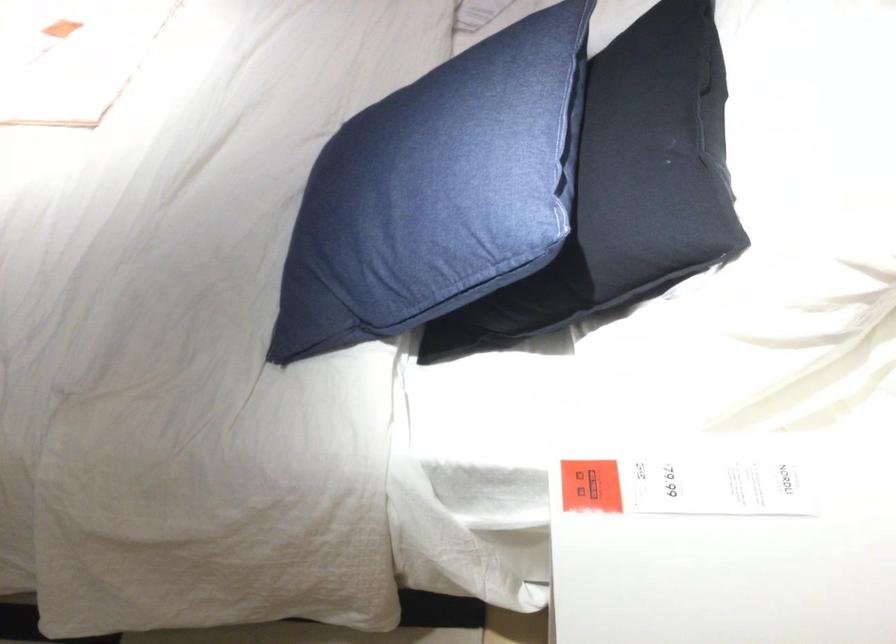
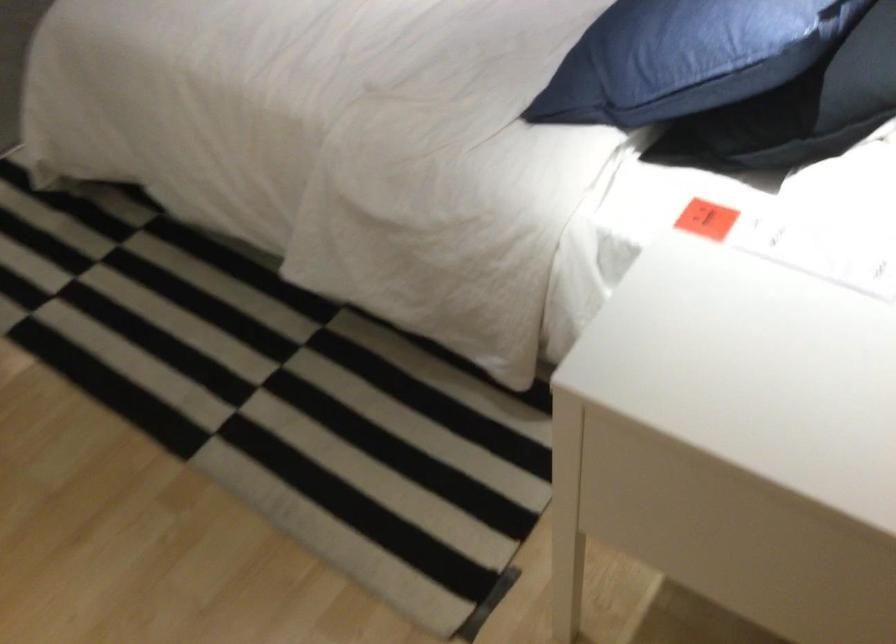
Where in the second image is the point corresponding to (x=423, y=269) from the first image?

(675, 58)